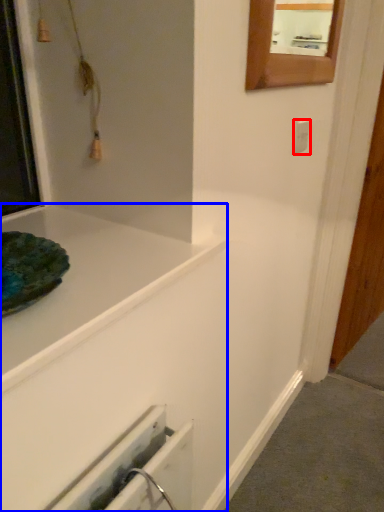
Question: Among these objects, which one is farthest to the camera, electric outlet (highlighted by a red box) or bathtub (highlighted by a blue box)?

Choices:
 (A) electric outlet
 (B) bathtub

Answer: (A)